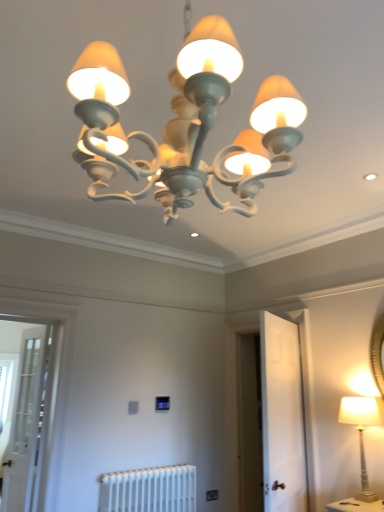
Image resolution: width=384 pixels, height=512 pixels. What do you see at coordinates (282, 416) in the screenshot?
I see `white matte door at center, the 1th screen door viewed from the right` at bounding box center [282, 416].

Image resolution: width=384 pixels, height=512 pixels. Describe the element at coordinates (24, 423) in the screenshot. I see `clear glass screen door at left, marked as the 2th screen door in a right-to-left arrangement` at that location.

What do you see at coordinates (362, 432) in the screenshot? I see `white painted wood lamp at right, the first lamp positioned from the right` at bounding box center [362, 432].

This screenshot has width=384, height=512. In order to click on white matte door at center, the 1th screen door viewed from the right in this screenshot , I will do `click(282, 416)`.

Is matte white chandelier at upper center, placed as the second lamp when sorted from back to front, at the back of clear glass screen door at left, which is the first screen door in left-to-right order?

No, clear glass screen door at left, which is the first screen door in left-to-right order,'s orientation is not away from matte white chandelier at upper center, placed as the second lamp when sorted from back to front.

Does point (17, 489) lie behind point (129, 165)?

Yes.

From the image's perspective, is clear glass screen door at left, marked as the 2th screen door in a right-to-left arrangement, located above or below matte white chandelier at upper center, marked as the 1th lamp in a front-to-back arrangement?

clear glass screen door at left, marked as the 2th screen door in a right-to-left arrangement, is below matte white chandelier at upper center, marked as the 1th lamp in a front-to-back arrangement.

Which point is more distant from viewer, (191, 493) or (29, 398)?

The point (191, 493) is farther from the camera.

Which is more to the left, white metallic radiator at lower center or clear glass screen door at left, marked as the 2th screen door in a right-to-left arrangement?

clear glass screen door at left, marked as the 2th screen door in a right-to-left arrangement.

Is white metallic radiator at lower center beside clear glass screen door at left, marked as the 2th screen door in a right-to-left arrangement?

They are not placed beside each other.

From the image's perspective, which one is positioned lower, white metallic radiator at lower center or clear glass screen door at left, which is the first screen door in left-to-right order?

white metallic radiator at lower center appears lower in the image.

Would you say white matte door at center, the 1th screen door viewed from the right, is inside or outside white painted wood lamp at right, the first lamp positioned from the right?

white matte door at center, the 1th screen door viewed from the right, is not inside white painted wood lamp at right, the first lamp positioned from the right, it's outside.

Is white matte door at center, the 1th screen door viewed from the right, positioned before white painted wood lamp at right, marked as the 1th lamp in a bottom-to-top arrangement?

Yes, it is in front of white painted wood lamp at right, marked as the 1th lamp in a bottom-to-top arrangement.

Between white matte door at center, which ranks as the 2th screen door in left-to-right order, and white painted wood lamp at right, the first lamp positioned from the back, which one has more height?

white matte door at center, which ranks as the 2th screen door in left-to-right order.

Is point (298, 492) closer to viewer compared to point (350, 418)?

That is False.

Relative to matte white chandelier at upper center, marked as the 1th lamp in a front-to-back arrangement, is white metallic radiator at lower center in front or behind?

In the image, white metallic radiator at lower center appears behind matte white chandelier at upper center, marked as the 1th lamp in a front-to-back arrangement.

Is white metallic radiator at lower center looking in the opposite direction of matte white chandelier at upper center, which is the 1th lamp in left-to-right order?

white metallic radiator at lower center does not have its back to matte white chandelier at upper center, which is the 1th lamp in left-to-right order.

In order to click on radiator on the left of matte white chandelier at upper center, which is the second lamp in bottom-to-top order in this screenshot , I will do `click(149, 490)`.

From the picture: Is white metallic radiator at lower center to the right of matte white chandelier at upper center, which is the second lamp in bottom-to-top order, from the viewer's perspective?

No, white metallic radiator at lower center is not to the right of matte white chandelier at upper center, which is the second lamp in bottom-to-top order.

From a real-world perspective, which is physically below, matte white chandelier at upper center, which is the 1th lamp in left-to-right order, or clear glass screen door at left, which is the first screen door in left-to-right order?

clear glass screen door at left, which is the first screen door in left-to-right order.

From the picture: Is clear glass screen door at left, marked as the 2th screen door in a right-to-left arrangement, inside matte white chandelier at upper center, acting as the second lamp starting from the right?

No, clear glass screen door at left, marked as the 2th screen door in a right-to-left arrangement, is located outside of matte white chandelier at upper center, acting as the second lamp starting from the right.

Is point (152, 187) farther from viewer compared to point (18, 384)?

No, it is not.

Considering the positions of objects matte white chandelier at upper center, marked as the 1th lamp in a front-to-back arrangement, and clear glass screen door at left, marked as the 2th screen door in a right-to-left arrangement, in the image provided, who is more to the left, matte white chandelier at upper center, marked as the 1th lamp in a front-to-back arrangement, or clear glass screen door at left, marked as the 2th screen door in a right-to-left arrangement,?

clear glass screen door at left, marked as the 2th screen door in a right-to-left arrangement, is more to the left.

Is the position of clear glass screen door at left, which is the first screen door in left-to-right order, less distant than that of white matte door at center, which ranks as the 2th screen door in left-to-right order?

No.

Choose the correct answer: Is clear glass screen door at left, marked as the 2th screen door in a right-to-left arrangement, inside white matte door at center, the 1th screen door viewed from the right, or outside it?

clear glass screen door at left, marked as the 2th screen door in a right-to-left arrangement, cannot be found inside white matte door at center, the 1th screen door viewed from the right.

From the picture: Can you see clear glass screen door at left, which is the first screen door in left-to-right order, touching white matte door at center, the 1th screen door viewed from the right?

clear glass screen door at left, which is the first screen door in left-to-right order, is not next to white matte door at center, the 1th screen door viewed from the right, and they're not touching.

Between clear glass screen door at left, which is the first screen door in left-to-right order, and white matte door at center, the 1th screen door viewed from the right, which one has less height?

Standing shorter between the two is white matte door at center, the 1th screen door viewed from the right.

From the image's perspective, which one is positioned higher, white matte door at center, the 1th screen door viewed from the right, or clear glass screen door at left, marked as the 2th screen door in a right-to-left arrangement?

white matte door at center, the 1th screen door viewed from the right.

Does white matte door at center, which ranks as the 2th screen door in left-to-right order, appear on the right side of clear glass screen door at left, marked as the 2th screen door in a right-to-left arrangement?

Indeed, white matte door at center, which ranks as the 2th screen door in left-to-right order, is positioned on the right side of clear glass screen door at left, marked as the 2th screen door in a right-to-left arrangement.

Where is `screen door behind the white matte door at center, which ranks as the 2th screen door in left-to-right order`? Image resolution: width=384 pixels, height=512 pixels. screen door behind the white matte door at center, which ranks as the 2th screen door in left-to-right order is located at coordinates (24, 423).

Considering the sizes of white matte door at center, the 1th screen door viewed from the right, and clear glass screen door at left, marked as the 2th screen door in a right-to-left arrangement, in the image, is white matte door at center, the 1th screen door viewed from the right, bigger or smaller than clear glass screen door at left, marked as the 2th screen door in a right-to-left arrangement,?

Considering their sizes, white matte door at center, the 1th screen door viewed from the right, takes up more space than clear glass screen door at left, marked as the 2th screen door in a right-to-left arrangement.

Identify the location of the 2nd screen door behind when counting from the matte white chandelier at upper center, acting as the second lamp starting from the right. (24, 423).

Where is `the 1st screen door positioned above the white metallic radiator at lower center (from a real-world perspective)`? This screenshot has width=384, height=512. the 1st screen door positioned above the white metallic radiator at lower center (from a real-world perspective) is located at coordinates (24, 423).

Based on the photo, when comparing their distances from matte white chandelier at upper center, placed as the second lamp when sorted from back to front, does white matte door at center, which ranks as the 2th screen door in left-to-right order, or white painted wood lamp at right, the first lamp positioned from the right, seem closer?

white painted wood lamp at right, the first lamp positioned from the right, lies closer to matte white chandelier at upper center, placed as the second lamp when sorted from back to front, than the other object.

When comparing their distances from white metallic radiator at lower center, does white matte door at center, which ranks as the 2th screen door in left-to-right order, or white painted wood lamp at right, the first lamp positioned from the right, seem further?

white painted wood lamp at right, the first lamp positioned from the right.

Looking at the image, which one is located closer to clear glass screen door at left, which is the first screen door in left-to-right order, white metallic radiator at lower center or white matte door at center, the 1th screen door viewed from the right?

The object closer to clear glass screen door at left, which is the first screen door in left-to-right order, is white metallic radiator at lower center.

Considering their positions, is white matte door at center, the 1th screen door viewed from the right, positioned further to white painted wood lamp at right, which is the second lamp in left-to-right order, than white metallic radiator at lower center?

white metallic radiator at lower center is further to white painted wood lamp at right, which is the second lamp in left-to-right order.

Which object lies nearer to the anchor point matte white chandelier at upper center, which is the 1th lamp in left-to-right order, clear glass screen door at left, which is the first screen door in left-to-right order, or white matte door at center, which ranks as the 2th screen door in left-to-right order?

white matte door at center, which ranks as the 2th screen door in left-to-right order, lies closer to matte white chandelier at upper center, which is the 1th lamp in left-to-right order, than the other object.

Consider the image. From the image, which object appears to be farther from white metallic radiator at lower center, white painted wood lamp at right, the second lamp viewed from the front, or clear glass screen door at left, marked as the 2th screen door in a right-to-left arrangement?

white painted wood lamp at right, the second lamp viewed from the front, is positioned further to the anchor white metallic radiator at lower center.

Estimate the real-world distances between objects in this image. Which object is further from clear glass screen door at left, which is the first screen door in left-to-right order, white matte door at center, which ranks as the 2th screen door in left-to-right order, or white metallic radiator at lower center?

Based on the image, white matte door at center, which ranks as the 2th screen door in left-to-right order, appears to be further to clear glass screen door at left, which is the first screen door in left-to-right order.

Looking at the image, which one is located further to white matte door at center, which ranks as the 2th screen door in left-to-right order, white metallic radiator at lower center or matte white chandelier at upper center, which is the 1th lamp in left-to-right order?

Among the two, matte white chandelier at upper center, which is the 1th lamp in left-to-right order, is located further to white matte door at center, which ranks as the 2th screen door in left-to-right order.

This screenshot has width=384, height=512. Find the location of `screen door between matte white chandelier at upper center, which is the 1th lamp in left-to-right order, and white painted wood lamp at right, the second lamp viewed from the top, from front to back`. screen door between matte white chandelier at upper center, which is the 1th lamp in left-to-right order, and white painted wood lamp at right, the second lamp viewed from the top, from front to back is located at coordinates pos(282,416).

Locate an element on the screen. The width and height of the screenshot is (384, 512). radiator between clear glass screen door at left, marked as the 2th screen door in a right-to-left arrangement, and white matte door at center, the 1th screen door viewed from the right, from left to right is located at coordinates (149, 490).

This screenshot has width=384, height=512. What are the coordinates of `screen door located between clear glass screen door at left, marked as the 2th screen door in a right-to-left arrangement, and white painted wood lamp at right, the second lamp viewed from the top, in the left-right direction` in the screenshot? It's located at (282, 416).

Find the location of a particular element. The image size is (384, 512). lamp located between matte white chandelier at upper center, which is the second lamp in bottom-to-top order, and clear glass screen door at left, which is the first screen door in left-to-right order, in the depth direction is located at coordinates (362, 432).